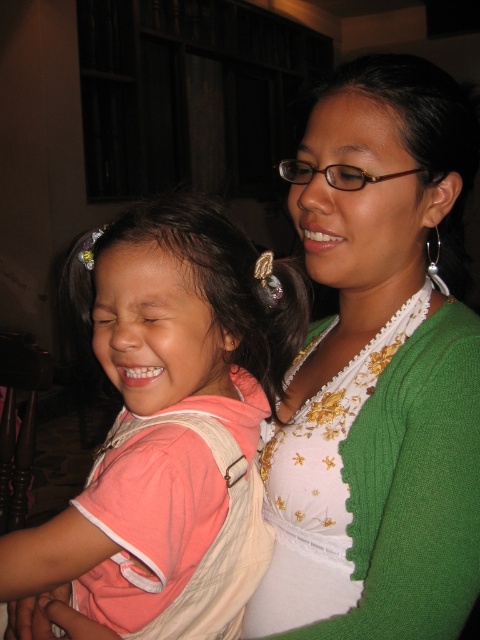
Between green textured sweater at upper right and pink fabric shirt at left, which one has less height?

Standing shorter between the two is pink fabric shirt at left.

What do you see at coordinates (379, 371) in the screenshot? This screenshot has width=480, height=640. I see `green textured sweater at upper right` at bounding box center [379, 371].

Which is behind, point (359, 513) or point (244, 396)?

The point (244, 396) is more distant.

The height and width of the screenshot is (640, 480). I want to click on green textured sweater at upper right, so click(379, 371).